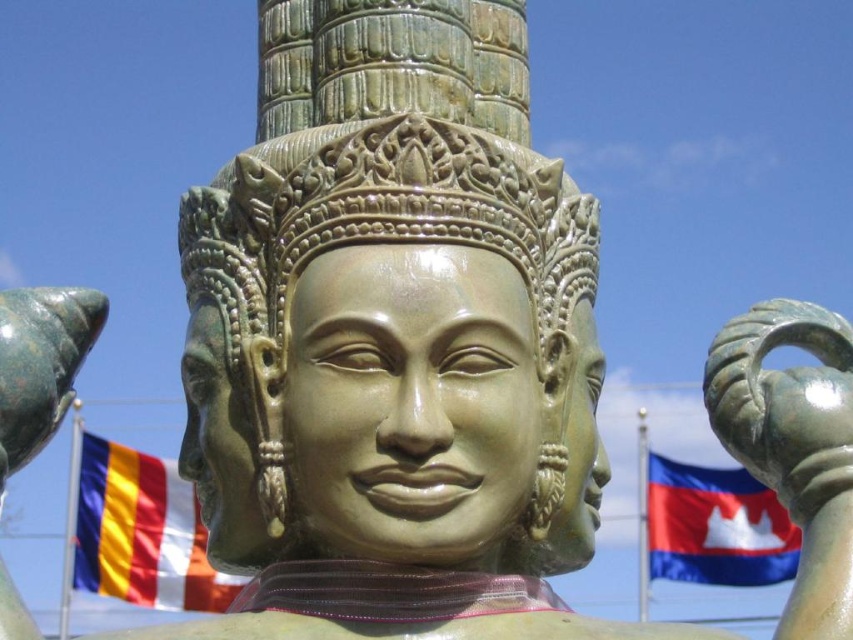
Is point (373, 148) positioned in front of point (167, 513)?

Yes, it is in front of point (167, 513).

Is point (323, 156) farther from camera compared to point (170, 486)?

No, (323, 156) is in front of (170, 486).

Who is more forward, (315, 196) or (167, 520)?

Point (315, 196)

I want to click on bronze statue at center, so click(x=379, y=243).

I want to click on bronze statue at center, so click(x=379, y=243).

Who is higher up, bronze statue at center or blue fabric flag at lower right?

bronze statue at center is higher up.

The width and height of the screenshot is (853, 640). What are the coordinates of `bronze statue at center` in the screenshot? It's located at (379, 243).

Which is behind, point (151, 582) or point (688, 492)?

Point (688, 492)

Does point (170, 525) come farther from viewer compared to point (651, 486)?

No, (170, 525) is closer to viewer.

Is point (84, 540) farther from camera compared to point (722, 518)?

No.

Identify the location of tri-colored fabric flag at center. (141, 531).